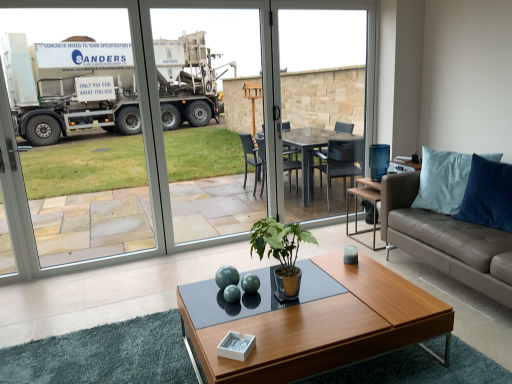
Locate an element on the screen. The width and height of the screenshot is (512, 384). vacant space in front of green glossy plant at center is located at coordinates (285, 332).